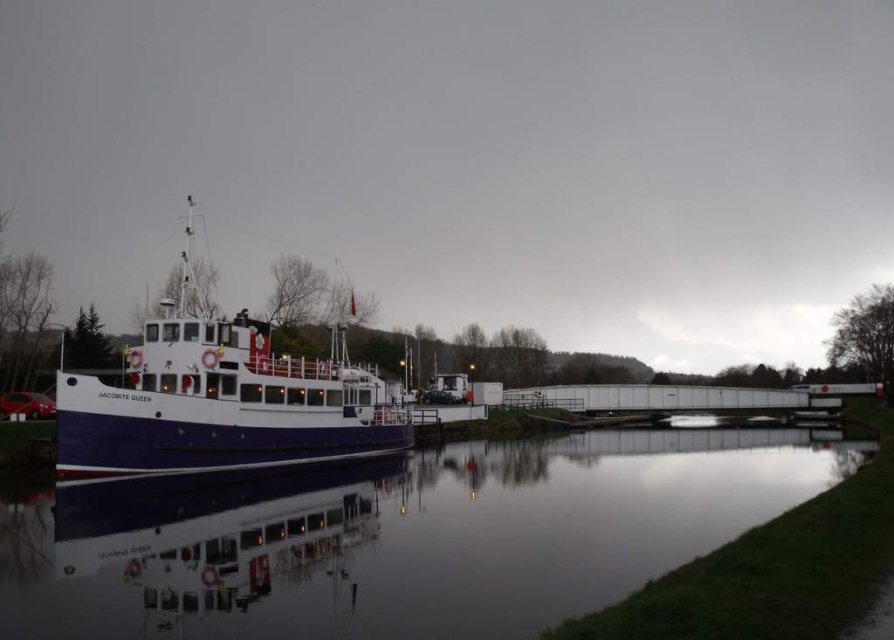
You are a photographer planning to capture the white glossy boat at left and the smooth water at lower center in a single shot. Which object should you focus on first if you want to ensure both are in frame without moving your camera position?

You should focus on the white glossy boat at left first because it is larger than the smooth water at lower center, so positioning it properly will help frame the smaller smooth water at lower center more easily.

You are standing on the Jacobite Queen passenger boat and want to locate the smooth water at lower center. According to the coordinates provided, where should you look relative to your position?

The smooth water at lower center is located at coordinates point (x=410, y=540), which means it is positioned to the lower right of your current position on the Jacobite Queen passenger boat.